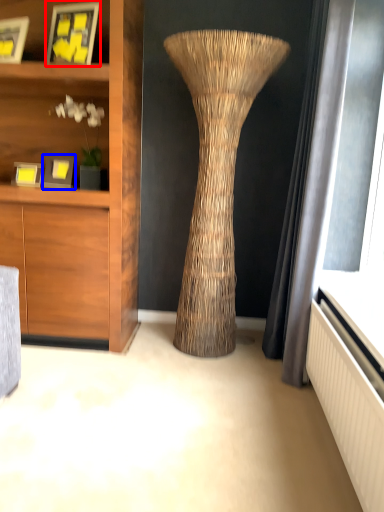
Question: Which object is further to the camera taking this photo, picture frame (highlighted by a red box) or picture frame (highlighted by a blue box)?

Choices:
 (A) picture frame
 (B) picture frame

Answer: (B)